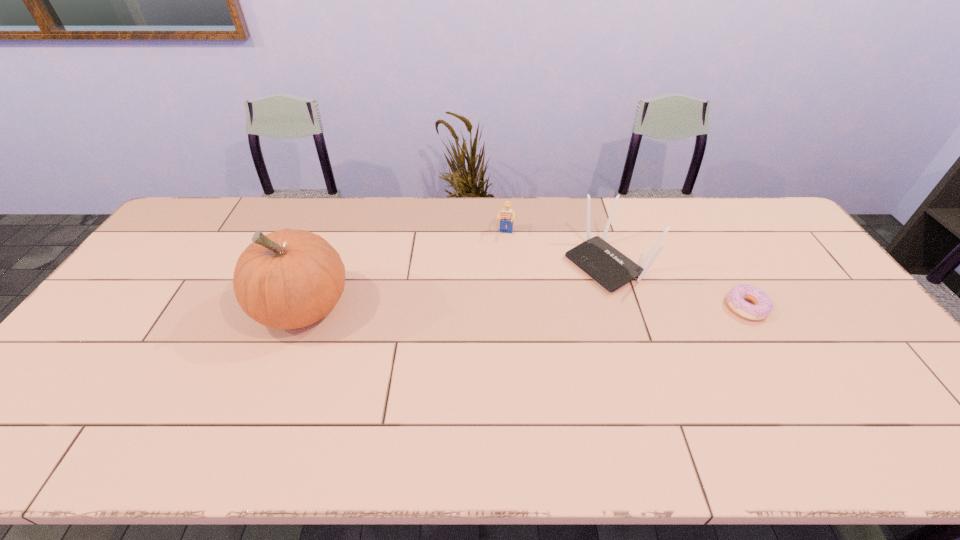
Where is `free space on the desktop that is between the pumpkin and the shortest object and is positioned on the face of the Lego`? free space on the desktop that is between the pumpkin and the shortest object and is positioned on the face of the Lego is located at coordinates tap(492, 307).

You are a GUI agent. You are given a task and a screenshot of the screen. Output one action in this format:
    pyautogui.click(x=<x>, y=<y>)
    Task: Click on the vacant space on the desktop that is between the leftmost object and the doughnut and is positioned on the front-facing side of the third shortest object
    The image size is (960, 540).
    Given the screenshot: What is the action you would take?
    click(x=527, y=307)